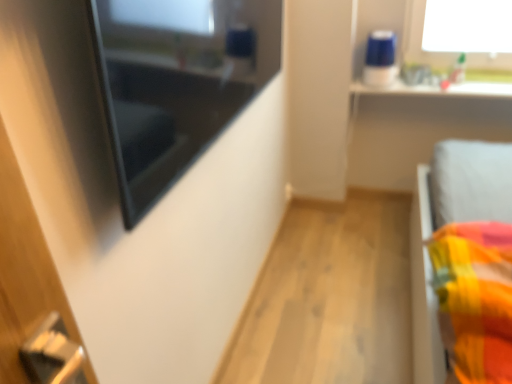
Question: From the image's perspective, is white glossy window sill at upper right located above or below matte black mirror at upper left?

Choices:
 (A) below
 (B) above

Answer: (B)

Question: Relative to matte black mirror at upper left, is white glossy window sill at upper right in front or behind?

Choices:
 (A) behind
 (B) front

Answer: (A)

Question: In the image, is white glossy window sill at upper right on the left side or the right side of matte black mirror at upper left?

Choices:
 (A) left
 (B) right

Answer: (B)

Question: Do you think matte black mirror at upper left is within white glossy window sill at upper right, or outside of it?

Choices:
 (A) outside
 (B) inside

Answer: (A)

Question: In the image, is matte black mirror at upper left positioned in front of or behind white glossy window sill at upper right?

Choices:
 (A) behind
 (B) front

Answer: (B)

Question: Looking at the image, does matte black mirror at upper left seem bigger or smaller compared to white glossy window sill at upper right?

Choices:
 (A) small
 (B) big

Answer: (B)

Question: Is matte black mirror at upper left wider or thinner than white glossy window sill at upper right?

Choices:
 (A) thin
 (B) wide

Answer: (A)